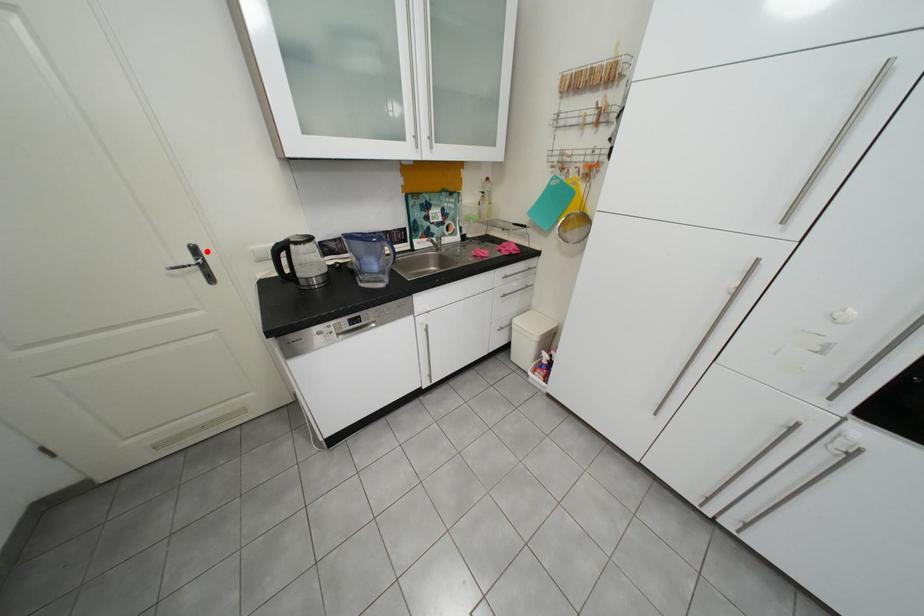
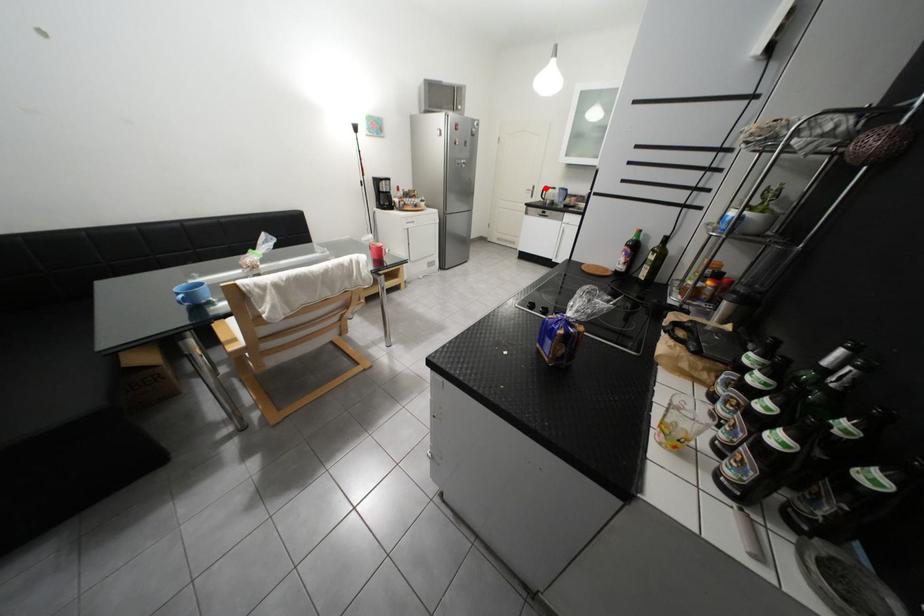
I am providing you with two images of the same scene from different viewpoints. A red point is marked on the first image and another point is marked on the second image. Is the red point in image1 aligned with the point shown in image2?

Yes